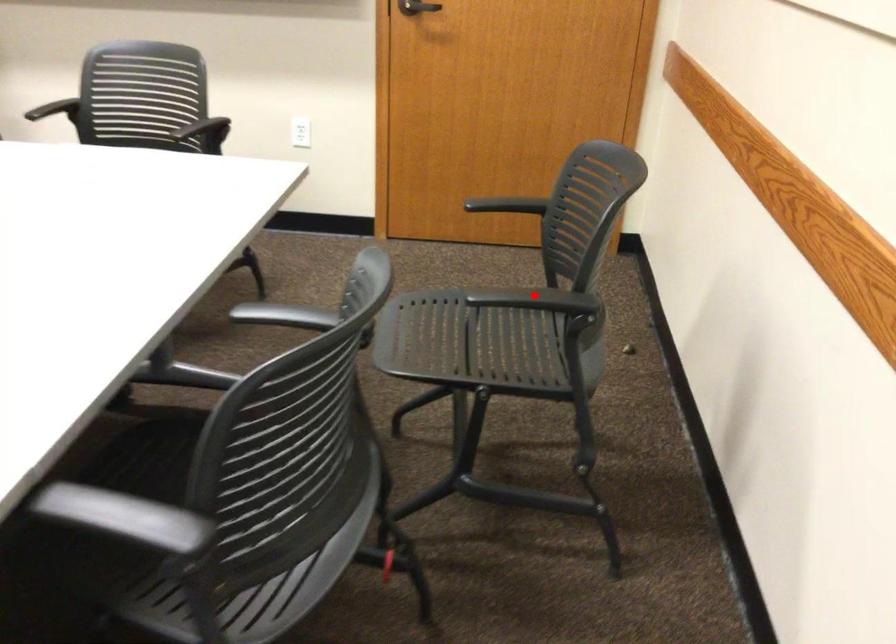
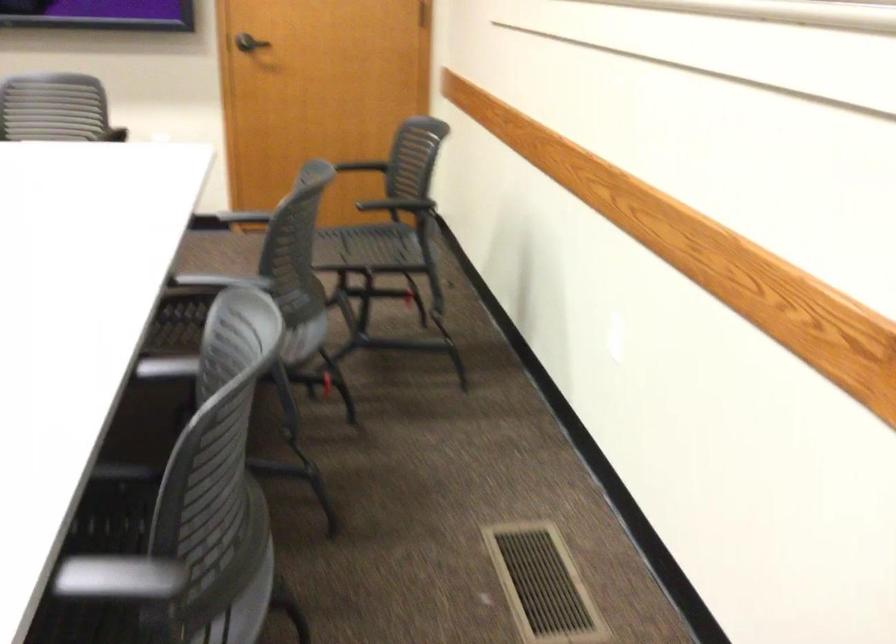
Question: I am providing you with two images of the same scene from different viewpoints. In image1, a red point is highlighted. Considering the same 3D point in image2, which of the following is correct?

Choices:
 (A) It is closer
 (B) It is farther

Answer: (B)